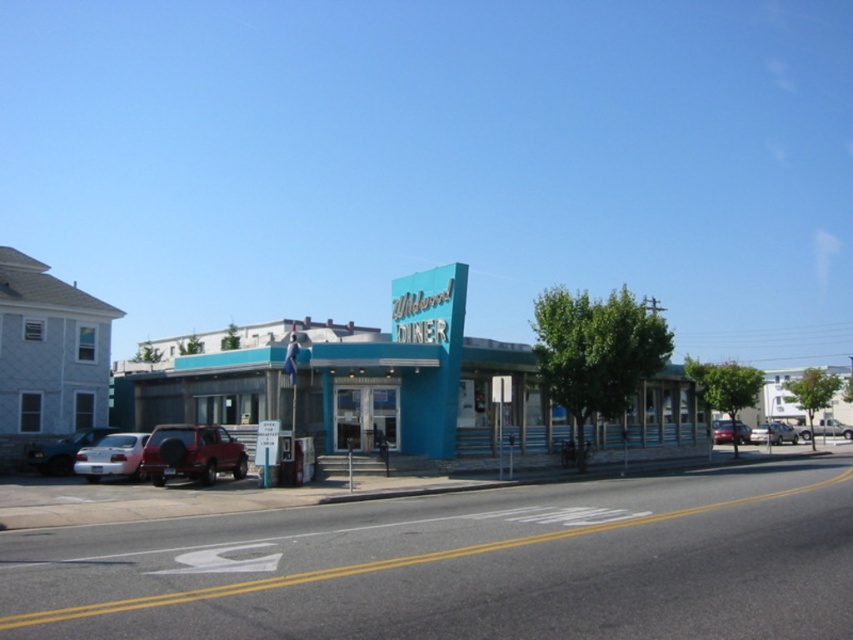
In the scene shown: You are standing at the entrance of the Wildwood Diner and want to take a photo of both the neon sign and the red SUV parked in the parking lot. The neon sign is at point (187, 424) and the red SUV is at point (97, 461). Which object should you focus on first to ensure both are in clear view?

You should focus on the neon sign at point (187, 424) first because it is closer to the camera than the red SUV at point (97, 461), ensuring both will be in clear view.

You are a delivery person arriving at the Wildwood Diner and need to park your vehicle. You see a matte silver suv at left and a metallic red car at center. Which vehicle is parked closer to the diner entrance?

The metallic red car at center is closer to the diner entrance because the matte silver suv at left is located above it, meaning it is further away from the entrance.